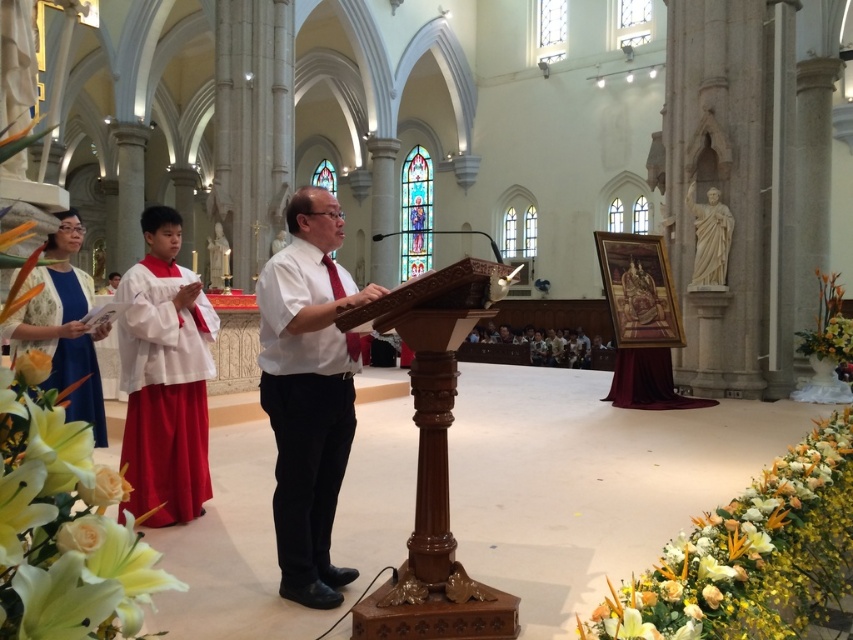
Can you confirm if brown polished wood podium at center is wider than white cotton shirt at center?

Indeed, brown polished wood podium at center has a greater width compared to white cotton shirt at center.

Where is `brown polished wood podium at center`? brown polished wood podium at center is located at coordinates (433, 465).

Does point (194, 369) come behind point (712, 230)?

That is False.

Between point (212, 332) and point (724, 276), which one is positioned behind?

The point (724, 276) is behind.

Identify the location of white satin robe at left. Image resolution: width=853 pixels, height=640 pixels. pyautogui.click(x=164, y=392).

Is brown polished wood podium at center positioned behind blue satin robe at lower left?

No, brown polished wood podium at center is in front of blue satin robe at lower left.

Is brown polished wood podium at center above blue satin robe at lower left?

Incorrect, brown polished wood podium at center is not positioned above blue satin robe at lower left.

The width and height of the screenshot is (853, 640). Describe the element at coordinates (433, 465) in the screenshot. I see `brown polished wood podium at center` at that location.

The height and width of the screenshot is (640, 853). In order to click on brown polished wood podium at center in this screenshot , I will do `click(433, 465)`.